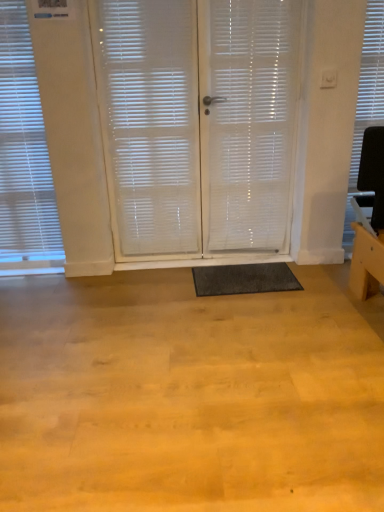
The image size is (384, 512). What do you see at coordinates (244, 279) in the screenshot?
I see `dark gray rubber mat at center` at bounding box center [244, 279].

In order to face white textured blind at upper right, positioned as the 1th window blind in right-to-left order, should I rotate leftwards or rightwards?

A 23.155 degree turn to the right will do.

I want to click on dark gray rubber mat at center, so [244, 279].

Is white translucent curtain at center completely or partially outside of white translucent blinds at left, the second window blind when ordered from right to left?

white translucent curtain at center is positioned outside white translucent blinds at left, the second window blind when ordered from right to left.

Considering the relative sizes of white translucent curtain at center and white translucent blinds at left, which is counted as the first window blind, starting from the left, in the image provided, is white translucent curtain at center thinner than white translucent blinds at left, which is counted as the first window blind, starting from the left,?

Yes.

Looking at this image, is white translucent curtain at center next to white translucent blinds at left, which is counted as the first window blind, starting from the left?

No, white translucent curtain at center is not in contact with white translucent blinds at left, which is counted as the first window blind, starting from the left.

Is point (123, 125) positioned before point (7, 177)?

That is True.

Is white textured screen door at center, marked as the first screen door in a left-to-right arrangement, next to white translucent curtain at center and touching it?

Yes, white textured screen door at center, marked as the first screen door in a left-to-right arrangement, is with white translucent curtain at center.

From the image's perspective, is white textured screen door at center, which is the second screen door in right-to-left order, above or below white translucent curtain at center?

From the image's perspective, white textured screen door at center, which is the second screen door in right-to-left order, appears below white translucent curtain at center.

The image size is (384, 512). Find the location of `the 2nd screen door behind the white translucent curtain at center, starting your count from the anchor`. the 2nd screen door behind the white translucent curtain at center, starting your count from the anchor is located at coordinates (199, 125).

Find the location of a particular element. window blind below the white textured blind at upper right, positioned as the 1th window blind in right-to-left order (from the image's perspective) is located at coordinates (24, 151).

Is white textured blind at upper right, acting as the second window blind starting from the left, a part of white translucent blinds at left, the second window blind when ordered from right to left?

No, white textured blind at upper right, acting as the second window blind starting from the left, is not surrounded by white translucent blinds at left, the second window blind when ordered from right to left.

From a real-world perspective, does white translucent blinds at left, which is counted as the first window blind, starting from the left, sit lower than white textured blind at upper right, positioned as the 1th window blind in right-to-left order?

Yes, from a real-world perspective, white translucent blinds at left, which is counted as the first window blind, starting from the left, is under white textured blind at upper right, positioned as the 1th window blind in right-to-left order.

Considering the sizes of white translucent blinds at left, which is counted as the first window blind, starting from the left, and white textured blind at upper right, acting as the second window blind starting from the left, in the image, is white translucent blinds at left, which is counted as the first window blind, starting from the left, wider or thinner than white textured blind at upper right, acting as the second window blind starting from the left,?

white translucent blinds at left, which is counted as the first window blind, starting from the left, is wider than white textured blind at upper right, acting as the second window blind starting from the left.

The height and width of the screenshot is (512, 384). What are the coordinates of `window blind above the white translucent blinds at left, which is counted as the first window blind, starting from the left (from the image's perspective)` in the screenshot? It's located at tap(369, 85).

Could you tell me if white textured blind at upper right, positioned as the 1th window blind in right-to-left order, is facing white translucent blinds at left, the second window blind when ordered from right to left?

No, white textured blind at upper right, positioned as the 1th window blind in right-to-left order, is not oriented towards white translucent blinds at left, the second window blind when ordered from right to left.

Is white textured blind at upper right, acting as the second window blind starting from the left, not within white translucent blinds at left, which is counted as the first window blind, starting from the left?

Yes, white textured blind at upper right, acting as the second window blind starting from the left, is outside of white translucent blinds at left, which is counted as the first window blind, starting from the left.

Considering the sizes of objects white textured blind at upper right, acting as the second window blind starting from the left, and white translucent blinds at left, the second window blind when ordered from right to left, in the image provided, who is shorter, white textured blind at upper right, acting as the second window blind starting from the left, or white translucent blinds at left, the second window blind when ordered from right to left,?

With less height is white textured blind at upper right, acting as the second window blind starting from the left.

Is dark gray rubber mat at center far away from white translucent screen door at center, the 1th screen door viewed from the right?

No, there isn't a large distance between dark gray rubber mat at center and white translucent screen door at center, the 1th screen door viewed from the right.

Would you say dark gray rubber mat at center is outside white translucent screen door at center, the 1th screen door viewed from the right?

Absolutely, dark gray rubber mat at center is external to white translucent screen door at center, the 1th screen door viewed from the right.

At what (x,y) coordinates should I click in order to perform the action: click on the 2nd screen door positioned above the dark gray rubber mat at center (from the image's perspective). Please return your answer as a coordinate pair (x, y). The image size is (384, 512). Looking at the image, I should click on (248, 123).

In terms of width, does dark gray rubber mat at center look wider or thinner when compared to white translucent screen door at center, the 1th screen door viewed from the right?

In the image, dark gray rubber mat at center appears to be wider than white translucent screen door at center, the 1th screen door viewed from the right.

How distant is white translucent blinds at left, the second window blind when ordered from right to left, from dark gray rubber mat at center?

white translucent blinds at left, the second window blind when ordered from right to left, and dark gray rubber mat at center are 1.25 meters apart from each other.

Is dark gray rubber mat at center at the back of white translucent blinds at left, the second window blind when ordered from right to left?

No, dark gray rubber mat at center is not at the back of white translucent blinds at left, the second window blind when ordered from right to left.

Which is behind, point (34, 234) or point (281, 274)?

The point (34, 234) is farther from the camera.

Is white textured blind at upper right, acting as the second window blind starting from the left, facing towards white translucent curtain at center?

No.

Is white textured blind at upper right, positioned as the 1th window blind in right-to-left order, to the left of white translucent curtain at center from the viewer's perspective?

In fact, white textured blind at upper right, positioned as the 1th window blind in right-to-left order, is to the right of white translucent curtain at center.

Consider the image. Is the position of white textured blind at upper right, positioned as the 1th window blind in right-to-left order, less distant than that of white translucent curtain at center?

No, it is not.

In the scene shown: Considering the sizes of white textured blind at upper right, acting as the second window blind starting from the left, and white translucent curtain at center in the image, is white textured blind at upper right, acting as the second window blind starting from the left, taller or shorter than white translucent curtain at center?

white textured blind at upper right, acting as the second window blind starting from the left, is shorter than white translucent curtain at center.

You are a GUI agent. You are given a task and a screenshot of the screen. Output one action in this format:
    pyautogui.click(x=<x>, y=<y>)
    Task: Click on the curtain above the white translucent blinds at left, which is counted as the first window blind, starting from the left (from the image's perspective)
    Image resolution: width=384 pixels, height=512 pixels.
    Given the screenshot: What is the action you would take?
    pyautogui.click(x=151, y=123)

Locate an element on the screen. The image size is (384, 512). curtain that appears on the left of white textured screen door at center, marked as the first screen door in a left-to-right arrangement is located at coordinates (151, 123).

Which object lies nearer to the anchor point white textured blind at upper right, acting as the second window blind starting from the left, white textured screen door at center, marked as the first screen door in a left-to-right arrangement, or white translucent blinds at left, the second window blind when ordered from right to left?

white textured screen door at center, marked as the first screen door in a left-to-right arrangement, lies closer to white textured blind at upper right, acting as the second window blind starting from the left, than the other object.

From the picture: Looking at the image, which one is located further to white textured blind at upper right, positioned as the 1th window blind in right-to-left order, white translucent screen door at center, which is the 2th screen door in left-to-right order, or dark gray rubber mat at center?

The object further to white textured blind at upper right, positioned as the 1th window blind in right-to-left order, is dark gray rubber mat at center.

Estimate the real-world distances between objects in this image. Which object is further from white textured blind at upper right, positioned as the 1th window blind in right-to-left order, white translucent blinds at left, which is counted as the first window blind, starting from the left, or dark gray rubber mat at center?

white translucent blinds at left, which is counted as the first window blind, starting from the left, is further to white textured blind at upper right, positioned as the 1th window blind in right-to-left order.

Considering their positions, is dark gray rubber mat at center positioned further to white translucent screen door at center, which is the 2th screen door in left-to-right order, than white textured screen door at center, which is the second screen door in right-to-left order?

dark gray rubber mat at center is further to white translucent screen door at center, which is the 2th screen door in left-to-right order.

When comparing their distances from dark gray rubber mat at center, does white textured screen door at center, marked as the first screen door in a left-to-right arrangement, or white textured blind at upper right, acting as the second window blind starting from the left, seem further?

Based on the image, white textured blind at upper right, acting as the second window blind starting from the left, appears to be further to dark gray rubber mat at center.

Looking at the image, which one is located closer to white translucent blinds at left, which is counted as the first window blind, starting from the left, white textured blind at upper right, acting as the second window blind starting from the left, or white textured screen door at center, which is the second screen door in right-to-left order?

The object closer to white translucent blinds at left, which is counted as the first window blind, starting from the left, is white textured screen door at center, which is the second screen door in right-to-left order.

Based on their spatial positions, is white textured blind at upper right, acting as the second window blind starting from the left, or white translucent screen door at center, which is the 2th screen door in left-to-right order, closer to dark gray rubber mat at center?

Based on the image, white translucent screen door at center, which is the 2th screen door in left-to-right order, appears to be nearer to dark gray rubber mat at center.

From the image, which object appears to be farther from white translucent blinds at left, which is counted as the first window blind, starting from the left, white translucent curtain at center or white textured screen door at center, marked as the first screen door in a left-to-right arrangement?

white textured screen door at center, marked as the first screen door in a left-to-right arrangement, is further to white translucent blinds at left, which is counted as the first window blind, starting from the left.

This screenshot has width=384, height=512. Identify the location of screen door between white translucent blinds at left, the second window blind when ordered from right to left, and white translucent screen door at center, which is the 2th screen door in left-to-right order. coord(199,125).

I want to click on curtain situated between white translucent blinds at left, which is counted as the first window blind, starting from the left, and white textured screen door at center, which is the second screen door in right-to-left order, from left to right, so click(151, 123).

Find the location of a particular element. Image resolution: width=384 pixels, height=512 pixels. curtain between white translucent screen door at center, the 1th screen door viewed from the right, and dark gray rubber mat at center vertically is located at coordinates (151, 123).

Find the location of a particular element. yoga mat between white translucent blinds at left, which is counted as the first window blind, starting from the left, and white translucent screen door at center, which is the 2th screen door in left-to-right order, from left to right is located at coordinates (244, 279).